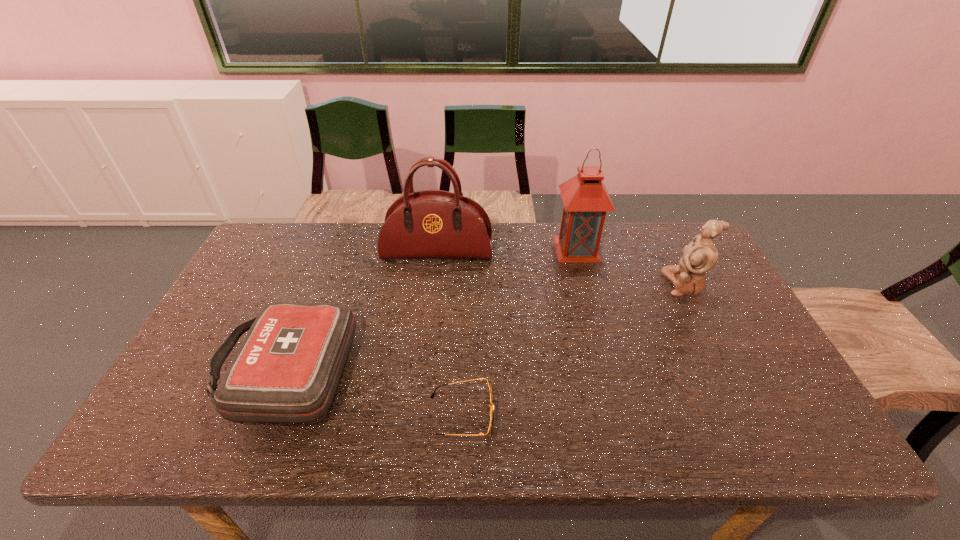
I want to click on vacant space located on the front-facing side of the rightmost object, so click(562, 284).

You are a GUI agent. You are given a task and a screenshot of the screen. Output one action in this format:
    pyautogui.click(x=<x>, y=<y>)
    Task: Click on the free region located 0.270m on the front-facing side of the rightmost object
    The image size is (960, 540).
    Given the screenshot: What is the action you would take?
    pyautogui.click(x=575, y=284)

Where is `free location located on the right of the first-aid kit`? The width and height of the screenshot is (960, 540). free location located on the right of the first-aid kit is located at coordinates (475, 370).

Where is `free space located on the lenses of the sunglasses`? free space located on the lenses of the sunglasses is located at coordinates (582, 416).

Where is `lantern that is at the far edge`? This screenshot has height=540, width=960. lantern that is at the far edge is located at coordinates (585, 198).

Where is `handbag at the far edge`? This screenshot has height=540, width=960. handbag at the far edge is located at coordinates (430, 224).

Find the location of `the first-aid kit located at the near edge`. the first-aid kit located at the near edge is located at coordinates (287, 370).

Where is `sunglasses located at the near edge`? This screenshot has width=960, height=540. sunglasses located at the near edge is located at coordinates (491, 416).

At what (x,y) coordinates should I click in order to perform the action: click on object present at the left edge. Please return your answer as a coordinate pair (x, y). Image resolution: width=960 pixels, height=540 pixels. Looking at the image, I should click on (287, 370).

You are a GUI agent. You are given a task and a screenshot of the screen. Output one action in this format:
    pyautogui.click(x=<x>, y=<y>)
    Task: Click on the object that is at the right edge
    The width and height of the screenshot is (960, 540).
    Given the screenshot: What is the action you would take?
    pyautogui.click(x=700, y=256)